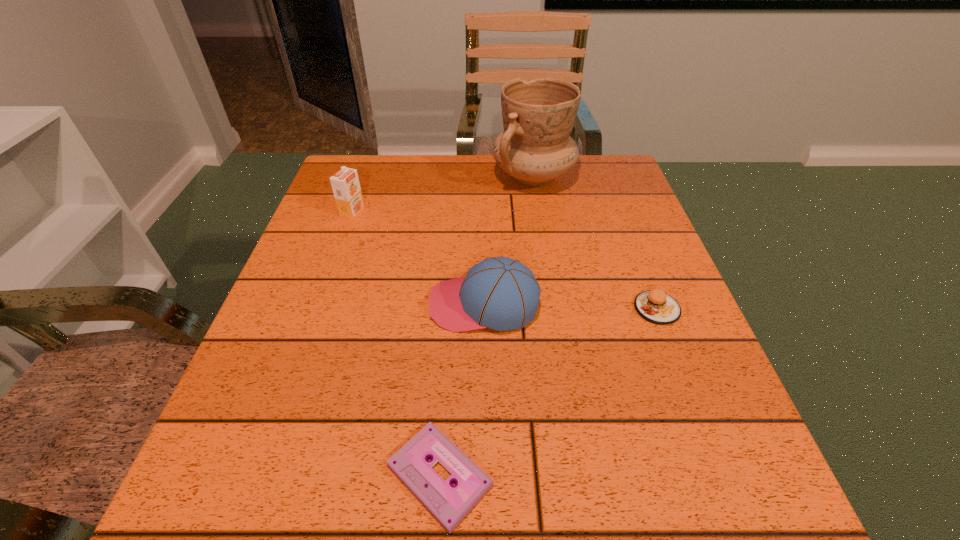
At what (x,y) coordinates should I click in order to perform the action: click on vacant region that satisfies the following two spatial constraints: 1. on the front-facing side of the patty; 2. on the right side of the baseball cap. Please return your answer as a coordinate pair (x, y). This screenshot has height=540, width=960. Looking at the image, I should click on (484, 308).

At what (x,y) coordinates should I click in order to perform the action: click on free location that satisfies the following two spatial constraints: 1. on the back side of the fourth tallest object; 2. on the right side of the nearest object. Please return your answer as a coordinate pair (x, y). This screenshot has width=960, height=540. Looking at the image, I should click on (450, 308).